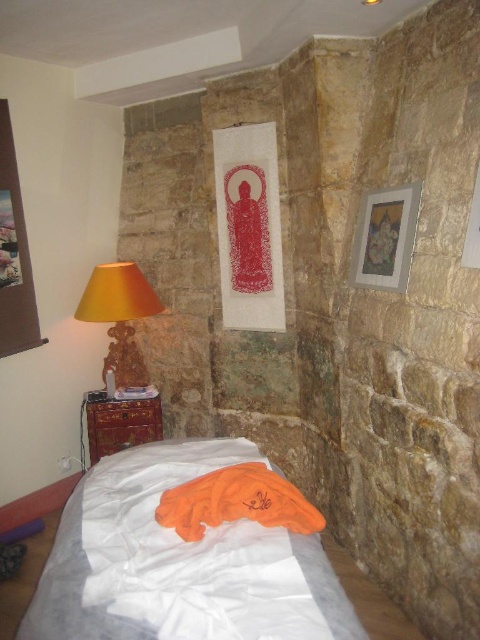
I want to click on white fabric bed at lower left, so click(180, 563).

Can you confirm if white fabric bed at lower left is taller than matte wooden picture frame at upper right?

In fact, white fabric bed at lower left may be shorter than matte wooden picture frame at upper right.

The width and height of the screenshot is (480, 640). What do you see at coordinates (180, 563) in the screenshot? I see `white fabric bed at lower left` at bounding box center [180, 563].

At what (x,y) coordinates should I click in order to perform the action: click on white fabric bed at lower left. Please return your answer as a coordinate pair (x, y). Looking at the image, I should click on (180, 563).

Is orange fabric at lower center closer to the viewer compared to wooden glossy dresser at lower left?

Yes, orange fabric at lower center is closer to the viewer.

Does point (197, 486) come closer to viewer compared to point (106, 433)?

That is True.

Where is `orange fabric at lower center`? This screenshot has width=480, height=640. orange fabric at lower center is located at coordinates (237, 502).

Does orange fabric at lower center appear on the left side of matte wooden picture frame at upper right?

Correct, you'll find orange fabric at lower center to the left of matte wooden picture frame at upper right.

Who is shorter, orange fabric at lower center or matte wooden picture frame at upper right?

orange fabric at lower center is shorter.

Find the location of a particular element. This screenshot has height=640, width=480. orange fabric at lower center is located at coordinates (237, 502).

You are a GUI agent. You are given a task and a screenshot of the screen. Output one action in this format:
    pyautogui.click(x=<x>, y=<y>)
    Task: Click on the orange fabric at lower center
    This screenshot has height=640, width=480.
    Given the screenshot: What is the action you would take?
    coord(237,502)